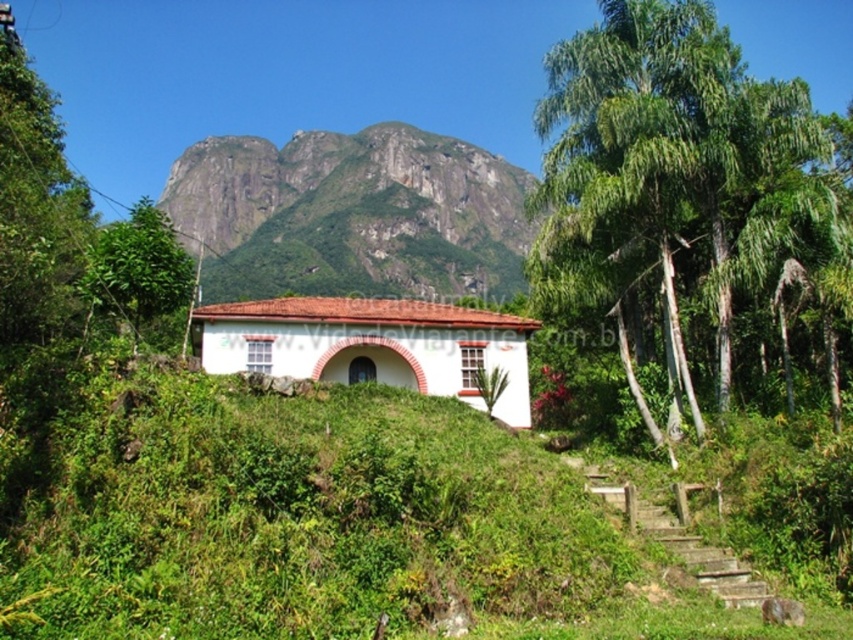
You are a gardener planning to plant a new tree in the yard of the small white house. You have two options based on the image you see. The green leafy palm at center right and the green leafy tree at left. Which one has a narrower width and would require less space between other plants?

The green leafy palm at center right has a narrower width than the green leafy tree at left, so it would require less space between other plants.

You are standing at the base of the mountain and want to reach the small white house with a red roof. You see a green leafy palm at center right and a rocky cliff at upper center. Which object is closer to you?

The green leafy palm at center right is closer to you because it is located below the rocky cliff at upper center.

You are standing in front of the small white house with a red roof and want to determine which tree is shorter between the green leafy palm at center right and the green leafy tree at left. Which one is shorter?

The green leafy palm at center right is shorter than the green leafy tree at left.